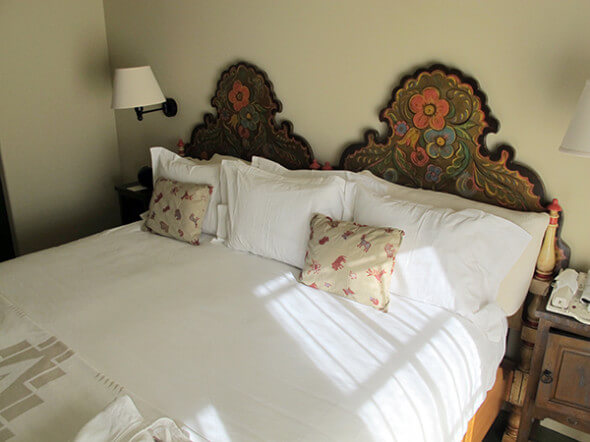
Identify the location of lamps. (135, 86), (576, 137).